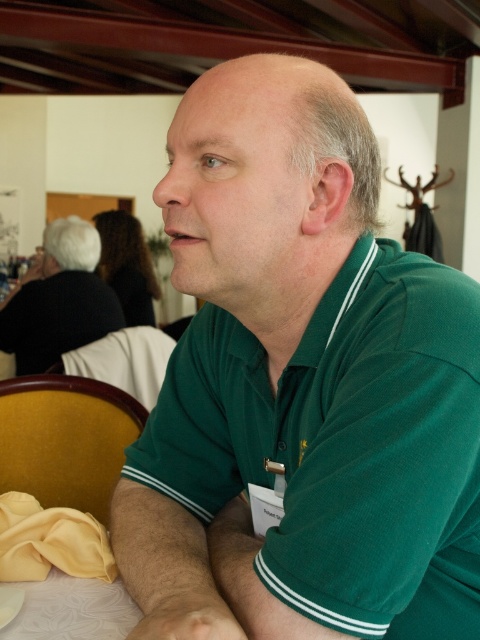
You are organizing a clothing display and need to arrange the green smooth shirt at center and the green matte shirt at upper right based on their sizes. Which shirt should be placed in the smaller section of the display?

The green smooth shirt at center should be placed in the smaller section of the display because it is smaller than the green matte shirt at upper right.